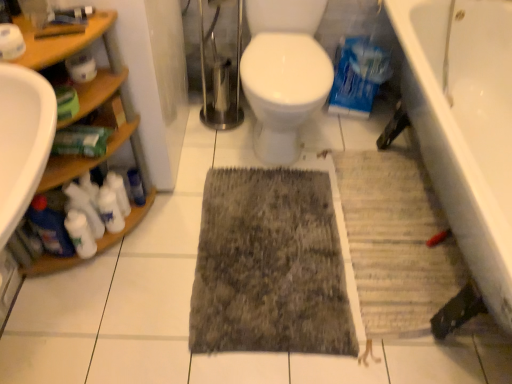
Find the location of a particular element. free space between white matte cleaning product at left, the 1th cleaning product from the right, and dark gray textured rug at center is located at coordinates (173, 240).